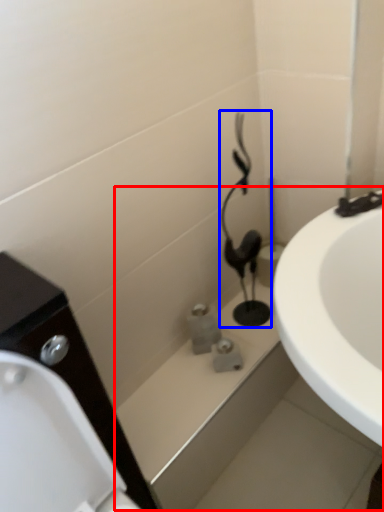
Question: Among these objects, which one is farthest to the camera, bath (highlighted by a red box) or plumbing fixture (highlighted by a blue box)?

Choices:
 (A) bath
 (B) plumbing fixture

Answer: (B)